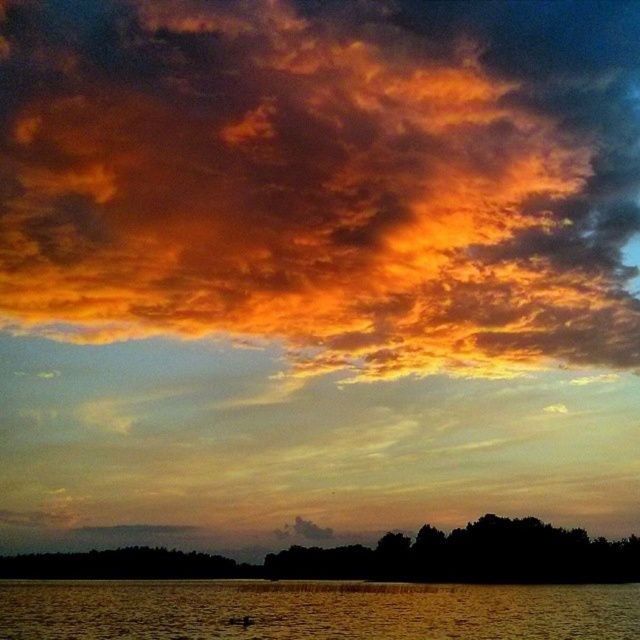
You are an artist trying to paint this sunset scene. You have to decide which area to focus on first based on their sizes. Which object should you paint first, the fiery cotton clouds at upper center or the golden reflective water at lower center?

The fiery cotton clouds at upper center is bigger than the golden reflective water at lower center, so you should paint the fiery cotton clouds at upper center first to capture its larger presence in the scene.

You are an artist trying to paint this sunset scene. You want to ensure the fiery cotton clouds at upper center and golden reflective water at lower center are proportionally accurate. Which object should you make wider in your painting?

The fiery cotton clouds at upper center should be made wider in the painting since their width is larger than the golden reflective water at lower center according to the description.